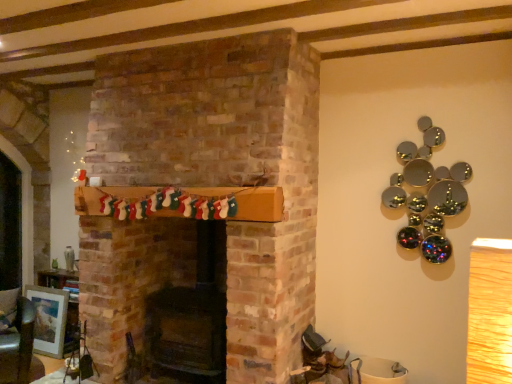
The image size is (512, 384). What do you see at coordinates (49, 319) in the screenshot? I see `matte silver picture frame at lower left` at bounding box center [49, 319].

Locate an element on the screen. The image size is (512, 384). matte silver picture frame at lower left is located at coordinates (49, 319).

The height and width of the screenshot is (384, 512). What do you see at coordinates (19, 347) in the screenshot? I see `green leather armchair at lower left` at bounding box center [19, 347].

Locate an element on the screen. Image resolution: width=512 pixels, height=384 pixels. green leather armchair at lower left is located at coordinates (19, 347).

This screenshot has height=384, width=512. I want to click on matte silver picture frame at lower left, so click(49, 319).

Does matte silver picture frame at lower left appear on the right side of green leather armchair at lower left?

No.

Relative to green leather armchair at lower left, is matte silver picture frame at lower left in front or behind?

In the image, matte silver picture frame at lower left appears behind green leather armchair at lower left.

Which point is more forward, (38, 337) or (21, 383)?

The point (21, 383) is closer.

From the image's perspective, relative to green leather armchair at lower left, is matte silver picture frame at lower left above or below?

Clearly, from the image's perspective, matte silver picture frame at lower left is below green leather armchair at lower left.

From a real-world perspective, between matte silver picture frame at lower left and green leather armchair at lower left, who is vertically lower?

In real-world perspective, matte silver picture frame at lower left is lower.

Can you confirm if matte silver picture frame at lower left is wider than green leather armchair at lower left?

No.

Does matte silver picture frame at lower left have a greater height compared to green leather armchair at lower left?

Incorrect, the height of matte silver picture frame at lower left is not larger of that of green leather armchair at lower left.

Can you confirm if matte silver picture frame at lower left is bigger than green leather armchair at lower left?

No.

Is green leather armchair at lower left located within matte silver picture frame at lower left?

That's incorrect, green leather armchair at lower left is not inside matte silver picture frame at lower left.

Is matte silver picture frame at lower left far from green leather armchair at lower left?

No, matte silver picture frame at lower left is in close proximity to green leather armchair at lower left.

Could you tell me if matte silver picture frame at lower left is facing green leather armchair at lower left?

Yes.

Can you tell me how much matte silver picture frame at lower left and green leather armchair at lower left differ in facing direction?

The angle between the facing direction of matte silver picture frame at lower left and the facing direction of green leather armchair at lower left is 47.7 degrees.

The width and height of the screenshot is (512, 384). I want to click on armchair on the right of matte silver picture frame at lower left, so click(19, 347).

Based on their positions, is green leather armchair at lower left located to the left or right of matte silver picture frame at lower left?

In the image, green leather armchair at lower left appears on the right side of matte silver picture frame at lower left.

Which object is closer to the camera, green leather armchair at lower left or matte silver picture frame at lower left?

green leather armchair at lower left is more forward.

Is point (19, 366) closer or farther from the camera than point (36, 313)?

Point (19, 366) is closer to the camera than point (36, 313).

From the image's perspective, would you say green leather armchair at lower left is shown under matte silver picture frame at lower left?

No, from the image's perspective, green leather armchair at lower left is not beneath matte silver picture frame at lower left.

From a real-world perspective, who is located higher, green leather armchair at lower left or matte silver picture frame at lower left?

green leather armchair at lower left.

Is green leather armchair at lower left wider than matte silver picture frame at lower left?

Indeed, green leather armchair at lower left has a greater width compared to matte silver picture frame at lower left.

Is green leather armchair at lower left taller or shorter than matte silver picture frame at lower left?

Clearly, green leather armchair at lower left is taller compared to matte silver picture frame at lower left.

Is green leather armchair at lower left bigger or smaller than matte silver picture frame at lower left?

green leather armchair at lower left is bigger than matte silver picture frame at lower left.

Is green leather armchair at lower left inside or outside of matte silver picture frame at lower left?

green leather armchair at lower left is spatially situated outside matte silver picture frame at lower left.

Based on the photo, is green leather armchair at lower left next to matte silver picture frame at lower left?

They are not placed beside each other.

Is green leather armchair at lower left oriented away from matte silver picture frame at lower left?

Yes, green leather armchair at lower left is facing away from matte silver picture frame at lower left.

How many degrees apart are the facing directions of green leather armchair at lower left and matte silver picture frame at lower left?

green leather armchair at lower left and matte silver picture frame at lower left are facing 47.7 degrees away from each other.

You are a GUI agent. You are given a task and a screenshot of the screen. Output one action in this format:
    pyautogui.click(x=<x>, y=<y>)
    Task: Click on the armchair on the right side of matte silver picture frame at lower left
    
    Given the screenshot: What is the action you would take?
    pyautogui.click(x=19, y=347)

Locate an element on the screen. The height and width of the screenshot is (384, 512). picture frame behind the green leather armchair at lower left is located at coordinates (49, 319).

Find the location of a particular element. The width and height of the screenshot is (512, 384). armchair above the matte silver picture frame at lower left (from a real-world perspective) is located at coordinates (19, 347).